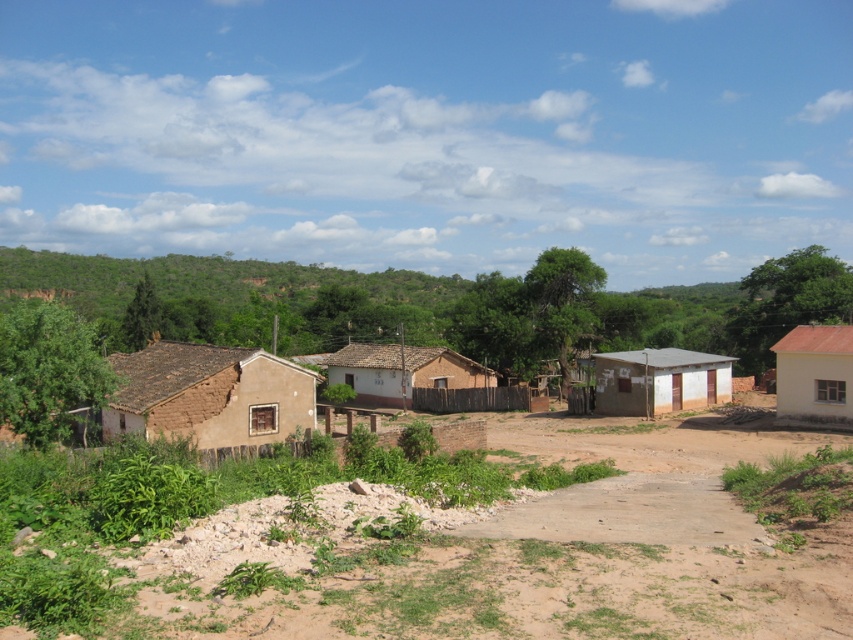
Question: Can you confirm if brown mud house at left is positioned below brown mud hut at center?

Choices:
 (A) yes
 (B) no

Answer: (B)

Question: Which object is closer to the camera taking this photo?

Choices:
 (A) brown mud hut at left
 (B) brown dirt field at center
 (C) brown mud house at left
 (D) brown mud hut at center

Answer: (B)

Question: Is brown dirt field at center thinner than white painted mud hut at center?

Choices:
 (A) no
 (B) yes

Answer: (A)

Question: Considering the real-world distances, which object is closest to the white matte house at right?

Choices:
 (A) brown mud house at left
 (B) white painted mud hut at center
 (C) brown dirt field at center

Answer: (A)

Question: Is brown mud hut at left bigger than brown mud hut at center?

Choices:
 (A) no
 (B) yes

Answer: (B)

Question: Which of these objects is positioned farthest from the brown dirt field at center?

Choices:
 (A) white matte house at right
 (B) white painted mud hut at center
 (C) brown mud hut at center
 (D) brown mud house at left

Answer: (C)